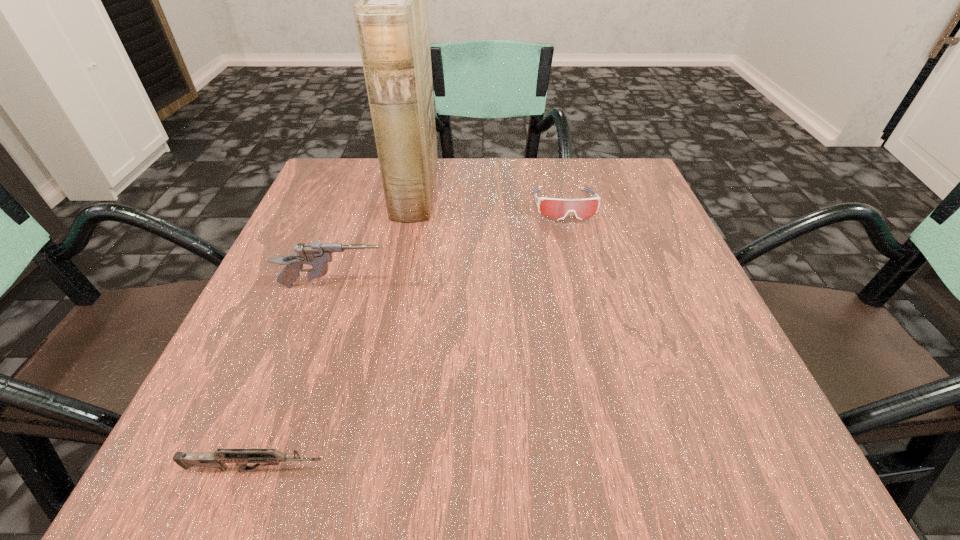
The width and height of the screenshot is (960, 540). I want to click on the tallest object, so click(391, 18).

Identify the location of the taller gun. (317, 255).

Image resolution: width=960 pixels, height=540 pixels. In order to click on the farther gun in this screenshot , I will do (x=317, y=255).

Identify the location of the rightmost object. (583, 209).

Where is `the nearest object`? The height and width of the screenshot is (540, 960). the nearest object is located at coordinates (217, 460).

The width and height of the screenshot is (960, 540). Find the location of `the shorter gun`. the shorter gun is located at coordinates (217, 460).

You are a GUI agent. You are given a task and a screenshot of the screen. Output one action in this format:
    pyautogui.click(x=<x>, y=<y>)
    Task: Click on the vacant space located on the cover of the tallest object
    The width and height of the screenshot is (960, 540).
    Given the screenshot: What is the action you would take?
    tap(509, 190)

In order to click on vacant space located at the barrel of the farther gun in this screenshot , I will do coord(426,287).

At what (x,y) coordinates should I click in order to perform the action: click on blank space located 0.310m on the front-facing side of the rightmost object. Please return your answer as a coordinate pair (x, y). Looking at the image, I should click on (599, 345).

You are a GUI agent. You are given a task and a screenshot of the screen. Output one action in this format:
    pyautogui.click(x=<x>, y=<y>)
    Task: Click on the blank area located 0.350m aimed along the barrel of the nearest object
    The height and width of the screenshot is (540, 960).
    Given the screenshot: What is the action you would take?
    pyautogui.click(x=612, y=470)